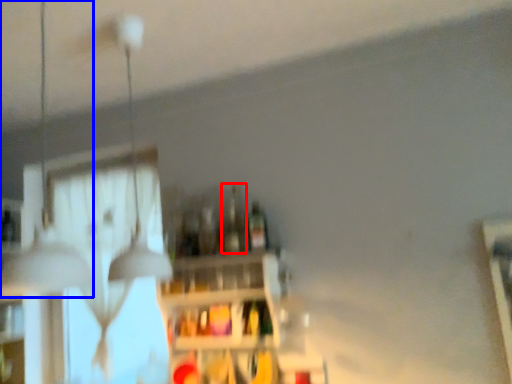
Question: Which object is further to the camera taking this photo, bottle (highlighted by a red box) or lamp (highlighted by a blue box)?

Choices:
 (A) bottle
 (B) lamp

Answer: (A)